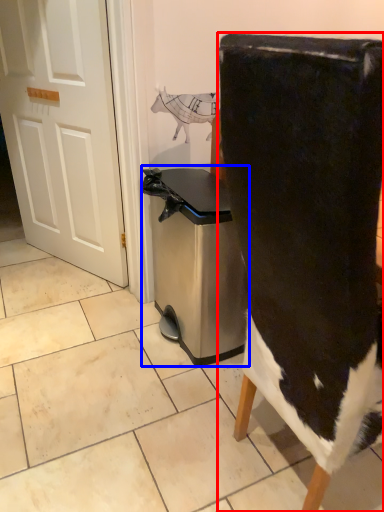
Question: Among these objects, which one is farthest to the camera, chair (highlighted by a red box) or dish washer (highlighted by a blue box)?

Choices:
 (A) chair
 (B) dish washer

Answer: (B)